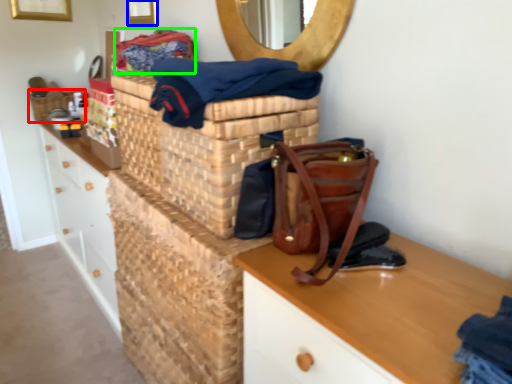
Question: Based on their relative distances, which object is nearer to basket (highlighted by a red box)? Choose from picture frame (highlighted by a blue box) and material (highlighted by a green box).

Choices:
 (A) picture frame
 (B) material

Answer: (A)